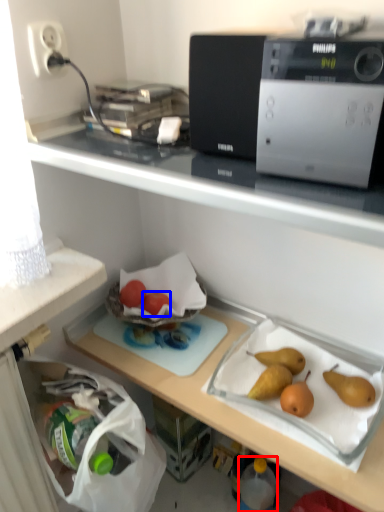
Question: Which object is further to the camera taking this photo, bottle (highlighted by a red box) or fruit (highlighted by a blue box)?

Choices:
 (A) bottle
 (B) fruit

Answer: (B)